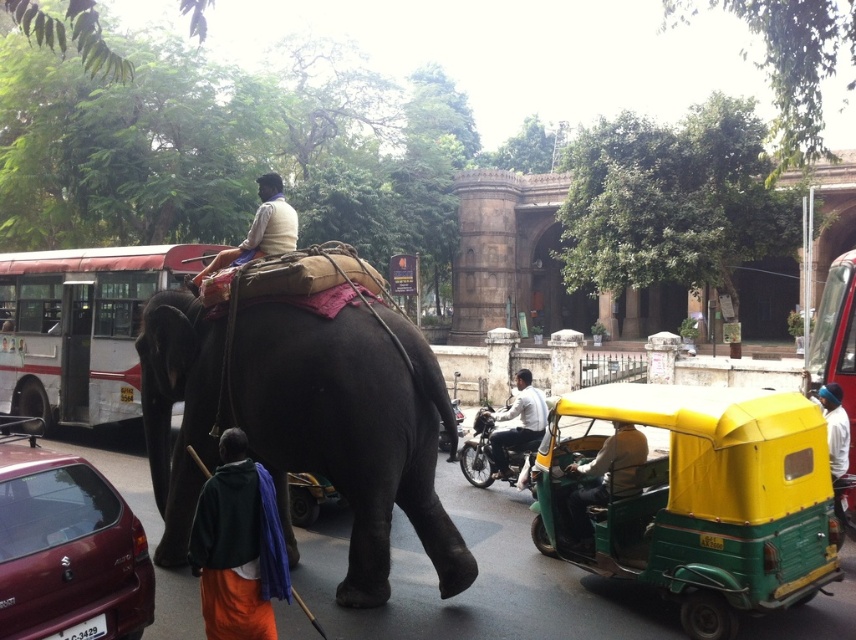
You are a pedestrian standing on the sidewalk and see the white painted bus at center and the white shirt at center. Which one is closer to you?

The white shirt at center is closer to you because the white painted bus at center is to the left of it, meaning the bus is further away.

You are a tourist standing at the edge of the street and want to take a photo of the light brown leather jacket at center. Where should you position yourself to capture it in your camera frame?

To capture the light brown leather jacket at center in your camera frame, position yourself at the edge of the street facing the jacket located at point (x=605, y=477).

You are a delivery person who needs to load a package onto the green plastic rickshaw at center. The package is 2 meters tall. Can the package be safely placed on the rickshaw without hitting the dark gray elephant at center?

The dark gray elephant at center is taller than the green plastic rickshaw at center. Since the package is 2 meters tall, there is a risk of it hitting the elephant if placed on the rickshaw. Ensure there is enough clearance before loading.